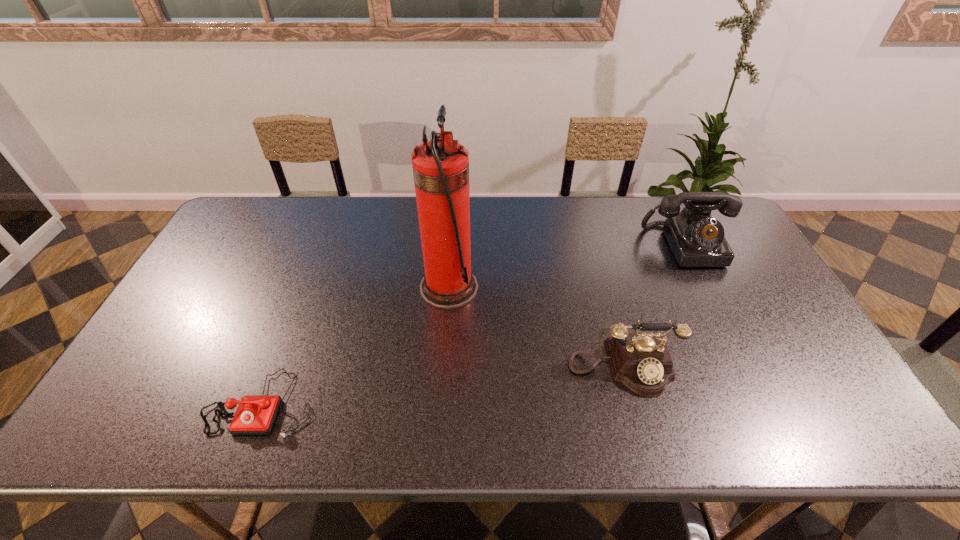
In order to click on the tallest object in this screenshot , I will do `click(440, 167)`.

Where is `the third object from right to left`? The height and width of the screenshot is (540, 960). the third object from right to left is located at coordinates (440, 167).

Locate an element on the screen. The height and width of the screenshot is (540, 960). the rightmost telephone is located at coordinates (696, 239).

You are a GUI agent. You are given a task and a screenshot of the screen. Output one action in this format:
    pyautogui.click(x=<x>, y=<y>)
    Task: Click on the farthest telephone
    This screenshot has width=960, height=540.
    Given the screenshot: What is the action you would take?
    pyautogui.click(x=696, y=239)

Where is `the second object from right to left`? The height and width of the screenshot is (540, 960). the second object from right to left is located at coordinates (642, 362).

This screenshot has width=960, height=540. Find the location of `the leftmost telephone`. the leftmost telephone is located at coordinates (255, 415).

I want to click on the shortest object, so click(255, 415).

Locate an element on the screen. free point located at the discharge end of the fire extinguisher is located at coordinates (502, 288).

This screenshot has height=540, width=960. What are the coordinates of `vacant region located on the dial of the rightmost object` in the screenshot? It's located at (713, 298).

Locate an element on the screen. object that is at the far edge is located at coordinates (696, 239).